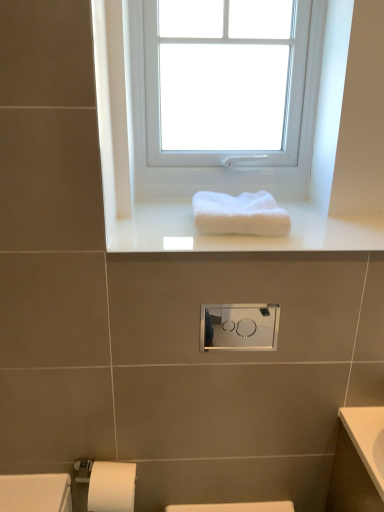
You are a GUI agent. You are given a task and a screenshot of the screen. Output one action in this format:
    pyautogui.click(x=<x>, y=<y>)
    Task: Click on the free location to the left of white fluffy towel at center
    
    Given the screenshot: What is the action you would take?
    pyautogui.click(x=157, y=226)